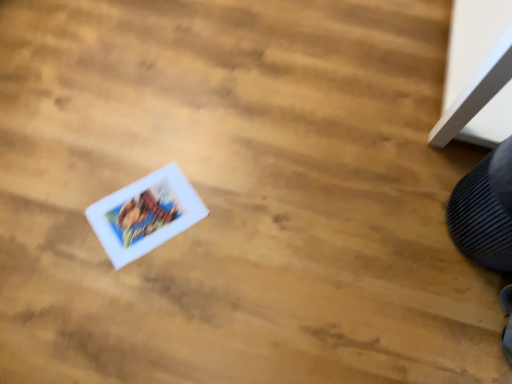
Locate an element on the screen. The width and height of the screenshot is (512, 384). black textured shoe at lower right is located at coordinates (485, 211).

Image resolution: width=512 pixels, height=384 pixels. What do you see at coordinates (485, 211) in the screenshot?
I see `black textured shoe at lower right` at bounding box center [485, 211].

This screenshot has width=512, height=384. Describe the element at coordinates (145, 214) in the screenshot. I see `white matte comic book at center` at that location.

Identify the location of white matte comic book at center. (145, 214).

Identify the location of black textured shoe at lower right. (485, 211).

Which object is positioned more to the left, white matte comic book at center or black textured shoe at lower right?

white matte comic book at center.

Which is behind, white matte comic book at center or black textured shoe at lower right?

white matte comic book at center is more distant.

Is point (141, 242) closer to viewer compared to point (475, 256)?

Yes, point (141, 242) is in front of point (475, 256).

From the image's perspective, which is above, white matte comic book at center or black textured shoe at lower right?

black textured shoe at lower right is shown above in the image.

From a real-world perspective, which object rests below the other?

white matte comic book at center.

Which of these two, white matte comic book at center or black textured shoe at lower right, is wider?

With larger width is white matte comic book at center.

Considering the sizes of objects white matte comic book at center and black textured shoe at lower right in the image provided, who is taller, white matte comic book at center or black textured shoe at lower right?

Standing taller between the two is black textured shoe at lower right.

Between white matte comic book at center and black textured shoe at lower right, which one has larger size?

black textured shoe at lower right.

Would you say white matte comic book at center is inside or outside black textured shoe at lower right?

white matte comic book at center is outside black textured shoe at lower right.

Are white matte comic book at center and black textured shoe at lower right far apart?

No, white matte comic book at center is in close proximity to black textured shoe at lower right.

Is white matte comic book at center positioned with its back to black textured shoe at lower right?

white matte comic book at center is not turned away from black textured shoe at lower right.

How much distance is there between white matte comic book at center and black textured shoe at lower right?

They are 32.84 inches apart.

Where is `shoe positioned vertically above the white matte comic book at center (from a real-world perspective)`? The height and width of the screenshot is (384, 512). shoe positioned vertically above the white matte comic book at center (from a real-world perspective) is located at coordinates pyautogui.click(x=485, y=211).

Considering the positions of objects black textured shoe at lower right and white matte comic book at center in the image provided, who is more to the left, black textured shoe at lower right or white matte comic book at center?

From the viewer's perspective, white matte comic book at center appears more on the left side.

Is black textured shoe at lower right behind white matte comic book at center?

No, black textured shoe at lower right is closer to the viewer.

Which is closer, (472, 252) or (138, 234)?

Point (472, 252) is closer to the camera than point (138, 234).

From the image's perspective, which is above, black textured shoe at lower right or white matte comic book at center?

black textured shoe at lower right.

From a real-world perspective, does black textured shoe at lower right sit lower than white matte comic book at center?

No.

Considering the sizes of black textured shoe at lower right and white matte comic book at center in the image, is black textured shoe at lower right wider or thinner than white matte comic book at center?

Considering their sizes, black textured shoe at lower right looks slimmer than white matte comic book at center.

In terms of height, does black textured shoe at lower right look taller or shorter compared to white matte comic book at center?

black textured shoe at lower right is taller than white matte comic book at center.

Based on their sizes in the image, would you say black textured shoe at lower right is bigger or smaller than white matte comic book at center?

Clearly, black textured shoe at lower right is larger in size than white matte comic book at center.

Which is correct: black textured shoe at lower right is inside white matte comic book at center, or outside of it?

black textured shoe at lower right lies outside white matte comic book at center.

Would you say black textured shoe at lower right is a long distance from white matte comic book at center?

black textured shoe at lower right is near white matte comic book at center, not far away.

Is black textured shoe at lower right positioned with its back to white matte comic book at center?

black textured shoe at lower right does not have its back to white matte comic book at center.

How different are the orientations of black textured shoe at lower right and white matte comic book at center in degrees?

132 degrees.

How far apart are black textured shoe at lower right and white matte comic book at center?

black textured shoe at lower right and white matte comic book at center are 32.84 inches apart from each other.

The image size is (512, 384). Identify the location of comic book on the left of black textured shoe at lower right. (145, 214).

Locate an element on the screen. This screenshot has width=512, height=384. comic book behind the black textured shoe at lower right is located at coordinates (x=145, y=214).

The width and height of the screenshot is (512, 384). I want to click on comic book on the left of black textured shoe at lower right, so click(x=145, y=214).